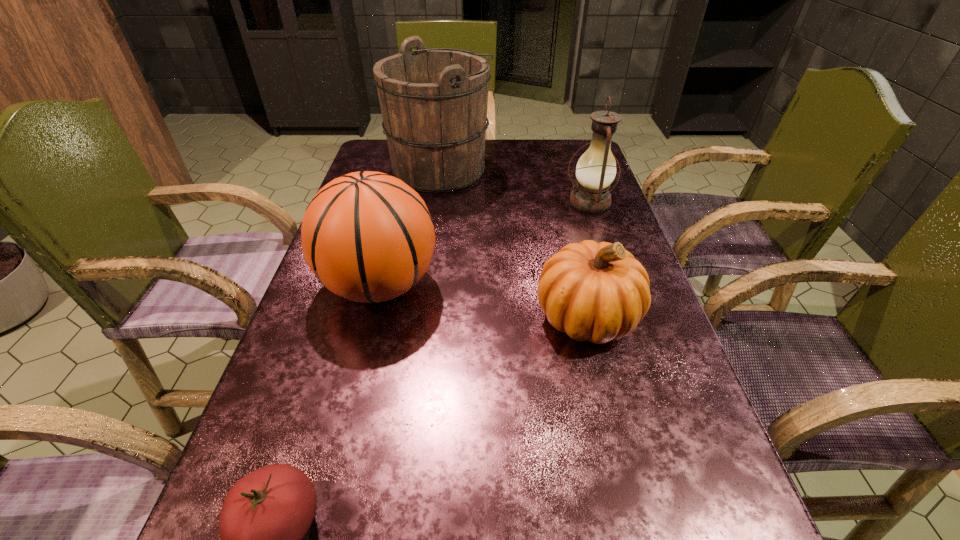
Image resolution: width=960 pixels, height=540 pixels. Identify the location of bucket. (433, 102).

I want to click on oil lamp, so click(x=596, y=169).

The image size is (960, 540). Identify the location of basketball. (368, 237).

Locate an element on the screen. pumpkin is located at coordinates (599, 292).

Where is `vacant space located on the right of the bucket`? The width and height of the screenshot is (960, 540). vacant space located on the right of the bucket is located at coordinates (601, 170).

This screenshot has width=960, height=540. Identify the location of free space located on the left of the oil lamp. (520, 202).

The height and width of the screenshot is (540, 960). What are the coordinates of `vacant space situated 0.300m on the front of the basketball` in the screenshot? It's located at (330, 484).

This screenshot has width=960, height=540. Find the location of `vacant space situated 0.140m on the front of the second shortest object`. vacant space situated 0.140m on the front of the second shortest object is located at coordinates (614, 429).

Where is `object present at the far edge`? This screenshot has width=960, height=540. object present at the far edge is located at coordinates (433, 102).

You are a GUI agent. You are given a task and a screenshot of the screen. Output one action in this format:
    pyautogui.click(x=<x>, y=<y>)
    Task: Click on the bucket present at the left edge
    The height and width of the screenshot is (540, 960).
    Given the screenshot: What is the action you would take?
    pyautogui.click(x=433, y=102)